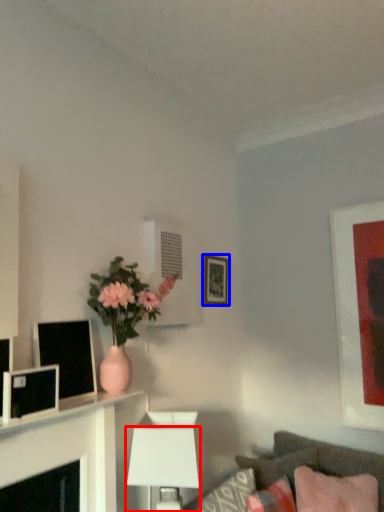
Question: Which of the following is the farthest to the observer, table lamp (highlighted by a red box) or picture frame (highlighted by a blue box)?

Choices:
 (A) table lamp
 (B) picture frame

Answer: (B)